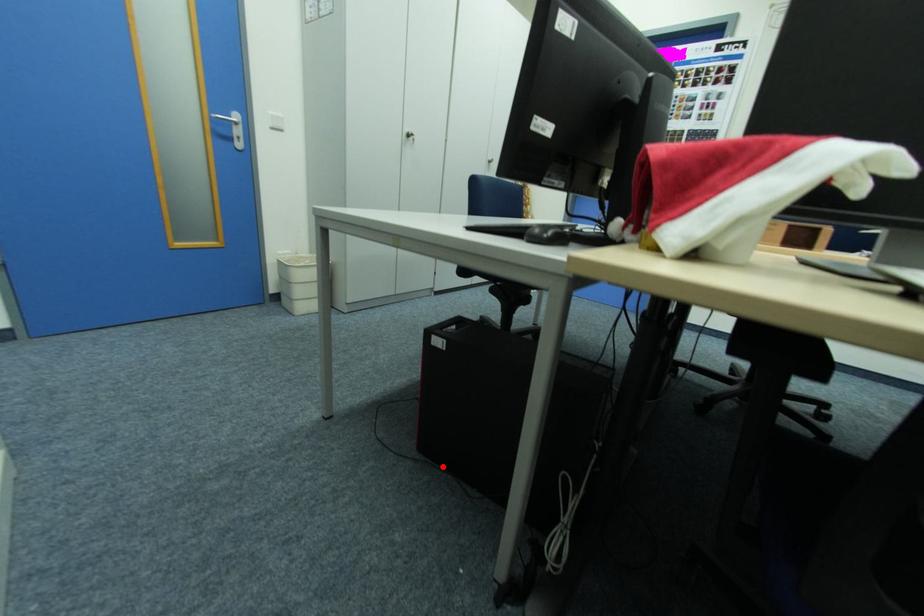
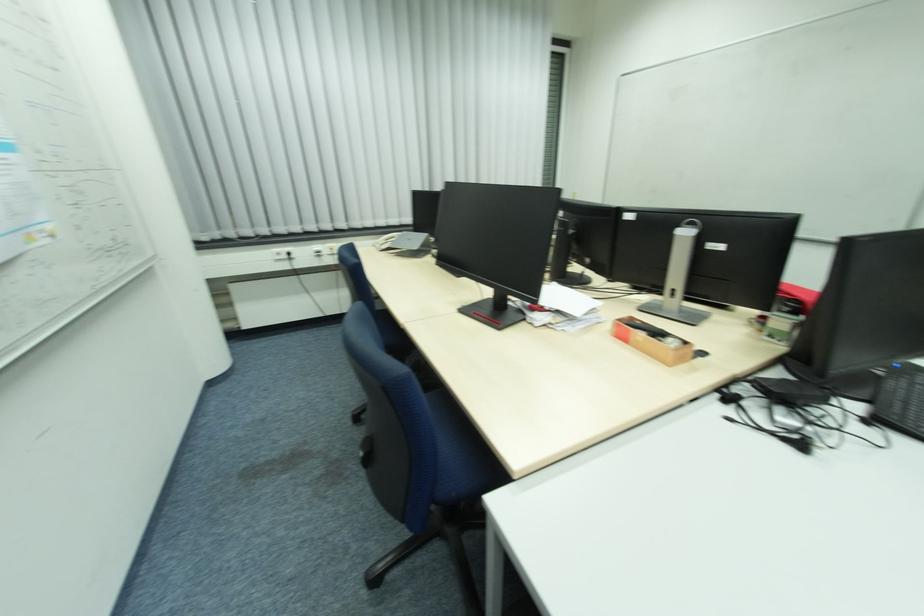
Question: I am providing you with two images of the same scene from different viewpoints. A red point is marked on the first image. Can you still see the location of the red point in image 2?

Choices:
 (A) Yes
 (B) No

Answer: (B)